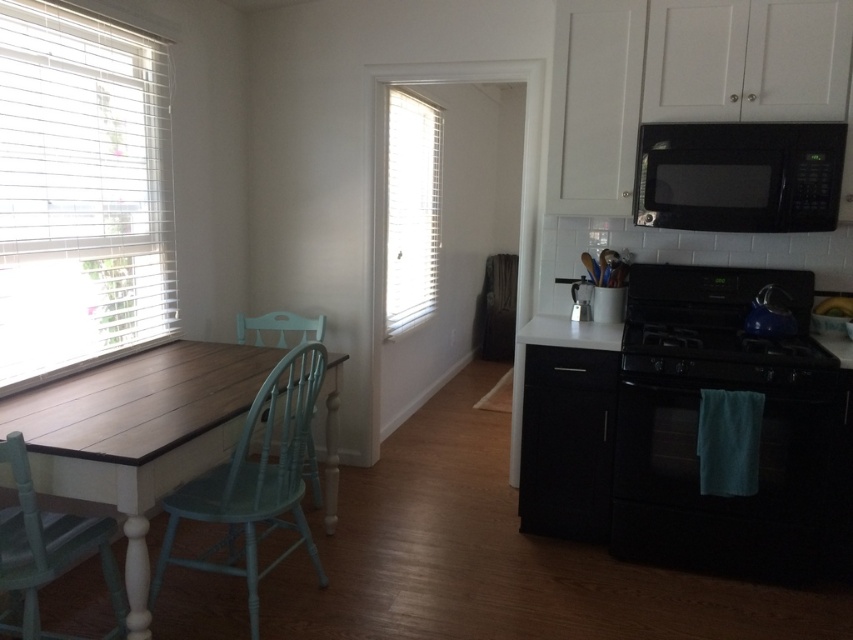
You are a painter who needs to hang a 30 inch wide painting between the white blinds at left and the light blue wood chair at center. Is there enough space between them to fit the painting?

The distance between the white blinds at left and the light blue wood chair at center is 35.05 inches, which is more than enough to fit a 30 inch wide painting between them.

You are a chef preparing to move the black matte oven at lower right to a new location. You want to place it on the floor next to the light blue wood chair at lower left. Is there enough vertical space between the oven and the ceiling to move it without tilting?

The black matte oven at lower right is located above the light blue wood chair at lower left, so moving it to the floor next to the chair would require lowering it. Since the oven is currently above the chair, there should be sufficient vertical space between the oven and the ceiling to move it without tilting, as it can be lowered directly downward.